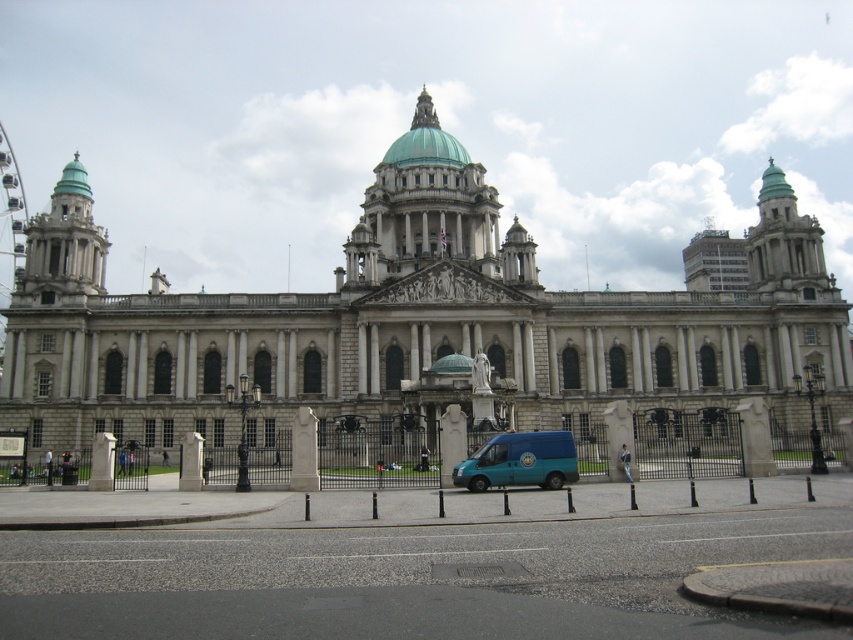
Can you confirm if white stone building at center is wider than green glass dome at center?

Indeed, white stone building at center has a greater width compared to green glass dome at center.

At what (x,y) coordinates should I click in order to perform the action: click on white stone building at center. Please return your answer as a coordinate pair (x, y). Looking at the image, I should click on pyautogui.click(x=415, y=323).

Is point (546, 348) in front of point (450, 160)?

Yes, it is.

The height and width of the screenshot is (640, 853). Identify the location of white stone building at center. (415, 323).

Does point (427, 122) lie in front of point (469, 572)?

No, (427, 122) is further to viewer.

Does green glass dome at center have a larger size compared to metallic gray drive at lower center?

Correct, green glass dome at center is larger in size than metallic gray drive at lower center.

Measure the distance between green glass dome at center and camera.

They are 106.04 meters apart.

At what (x,y) coordinates should I click in order to perform the action: click on green glass dome at center. Please return your answer as a coordinate pair (x, y). Looking at the image, I should click on (425, 140).

Does point (556, 480) come closer to viewer compared to point (457, 570)?

No, it is not.

Which is behind, point (456, 481) or point (454, 573)?

Point (456, 481)

At what (x,y) coordinates should I click in order to perform the action: click on teal matte van at center. Please return your answer as a coordinate pair (x, y). Looking at the image, I should click on (519, 461).